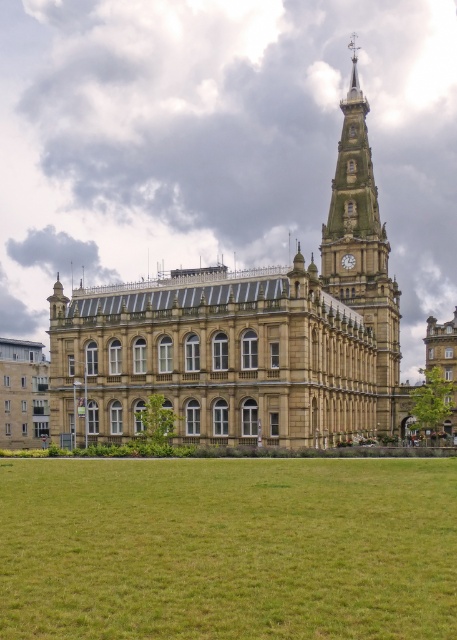
Question: Is green grass at lower center bigger than golden stone clock tower at upper right?

Choices:
 (A) no
 (B) yes

Answer: (A)

Question: Is green grass at lower center further to the viewer compared to golden stone clock tower at upper right?

Choices:
 (A) no
 (B) yes

Answer: (A)

Question: Can you confirm if green grass at lower center is positioned to the left of golden stone clock tower at upper right?

Choices:
 (A) no
 (B) yes

Answer: (B)

Question: Which point appears closest to the camera in this image?

Choices:
 (A) (190, 531)
 (B) (387, 296)

Answer: (A)

Question: Which of the following is the farthest from the observer?

Choices:
 (A) golden stone clock tower at upper right
 (B) green grass at lower center

Answer: (A)